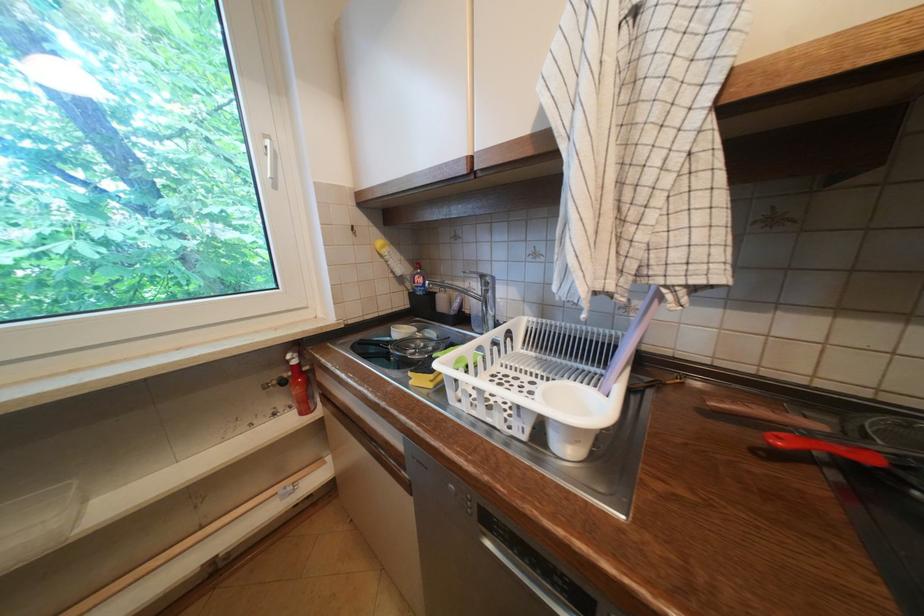
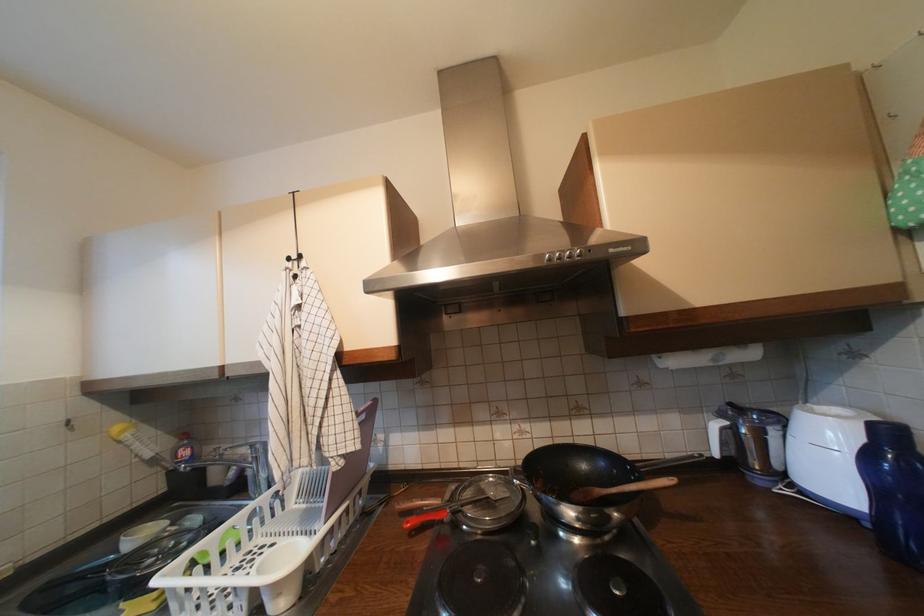
In the second image, find the point that corresponds to (788,440) in the first image.

(417, 524)